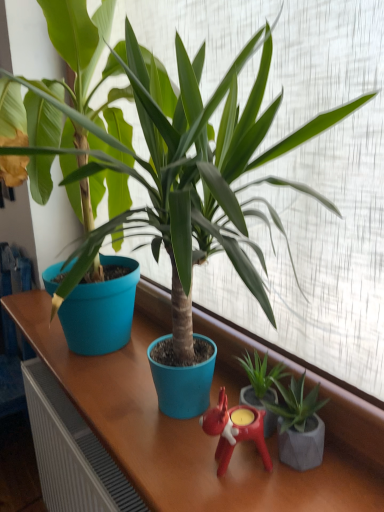
Question: Is green matte plant at center, which is counted as the second houseplant, starting from the left, closer to the viewer compared to rubberized red candle holder at center?

Choices:
 (A) yes
 (B) no

Answer: (B)

Question: Is green matte plant at center, which is counted as the second houseplant, starting from the left, with rubberized red candle holder at center?

Choices:
 (A) no
 (B) yes

Answer: (B)

Question: Are green matte plant at center, which is counted as the second houseplant, starting from the left, and rubberized red candle holder at center far apart?

Choices:
 (A) no
 (B) yes

Answer: (A)

Question: Is green matte plant at center, the 2th houseplant in the right-to-left sequence, positioned beyond the bounds of rubberized red candle holder at center?

Choices:
 (A) yes
 (B) no

Answer: (A)

Question: From the image's perspective, is green matte plant at center, which is counted as the second houseplant, starting from the left, below rubberized red candle holder at center?

Choices:
 (A) no
 (B) yes

Answer: (A)

Question: Is green matte plant at center, the 2th houseplant in the right-to-left sequence, inside the boundaries of green matte plant at lower right, which appears as the third houseplant when viewed from the left, or outside?

Choices:
 (A) inside
 (B) outside

Answer: (B)

Question: In the image, is green matte plant at center, which is counted as the second houseplant, starting from the left, positioned in front of or behind green matte plant at lower right, the 1th houseplant viewed from the right?

Choices:
 (A) behind
 (B) front

Answer: (A)

Question: Is green matte plant at center, the 2th houseplant in the right-to-left sequence, bigger or smaller than green matte plant at lower right, the 1th houseplant viewed from the right?

Choices:
 (A) big
 (B) small

Answer: (B)

Question: From a real-world perspective, is green matte plant at center, the 2th houseplant in the right-to-left sequence, physically located above or below green matte plant at lower right, the 1th houseplant viewed from the right?

Choices:
 (A) above
 (B) below

Answer: (B)

Question: In terms of size, does rubberized red candle holder at center appear bigger or smaller than green matte plant at center, the 2th houseplant in the right-to-left sequence?

Choices:
 (A) small
 (B) big

Answer: (A)

Question: From the image's perspective, is rubberized red candle holder at center above or below green matte plant at center, the 2th houseplant in the right-to-left sequence?

Choices:
 (A) below
 (B) above

Answer: (A)

Question: Is rubberized red candle holder at center in front of or behind green matte plant at center, the 2th houseplant in the right-to-left sequence, in the image?

Choices:
 (A) front
 (B) behind

Answer: (A)

Question: Does point [x=266, y=463] appear closer or farther from the camera than point [x=268, y=375]?

Choices:
 (A) closer
 (B) farther

Answer: (A)

Question: Does point (210, 430) appear closer or farther from the camera than point (120, 188)?

Choices:
 (A) closer
 (B) farther

Answer: (A)

Question: Visually, is rubberized red candle holder at center positioned to the left or to the right of matte blue pot at center, the third houseplant viewed from the right?

Choices:
 (A) right
 (B) left

Answer: (A)